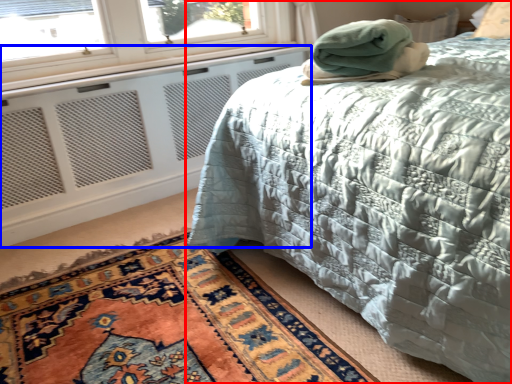
Question: Which object is closer to the camera taking this photo, bed (highlighted by a red box) or radiator (highlighted by a blue box)?

Choices:
 (A) bed
 (B) radiator

Answer: (A)